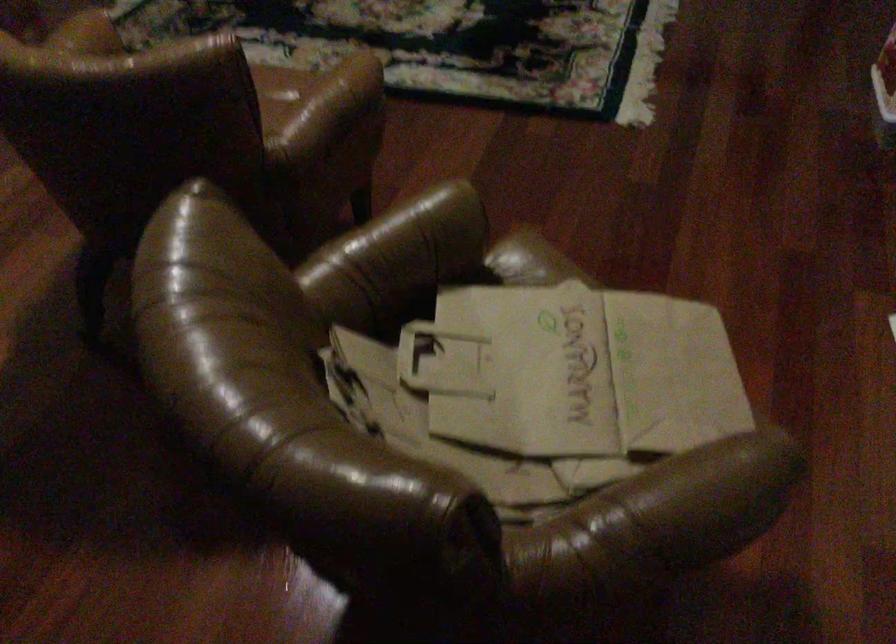
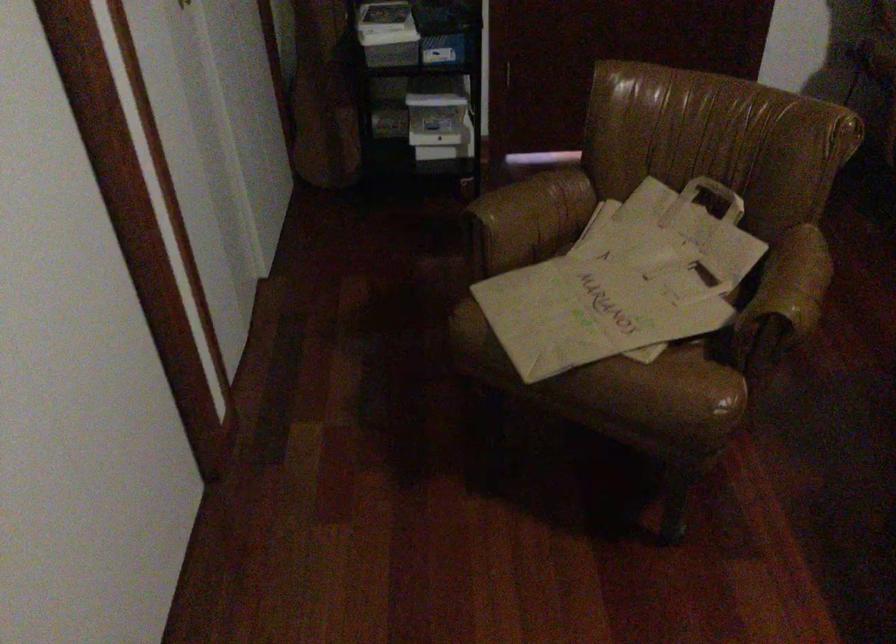
Find the pixel in the second image that matches point 601,476 in the first image.

(532, 216)